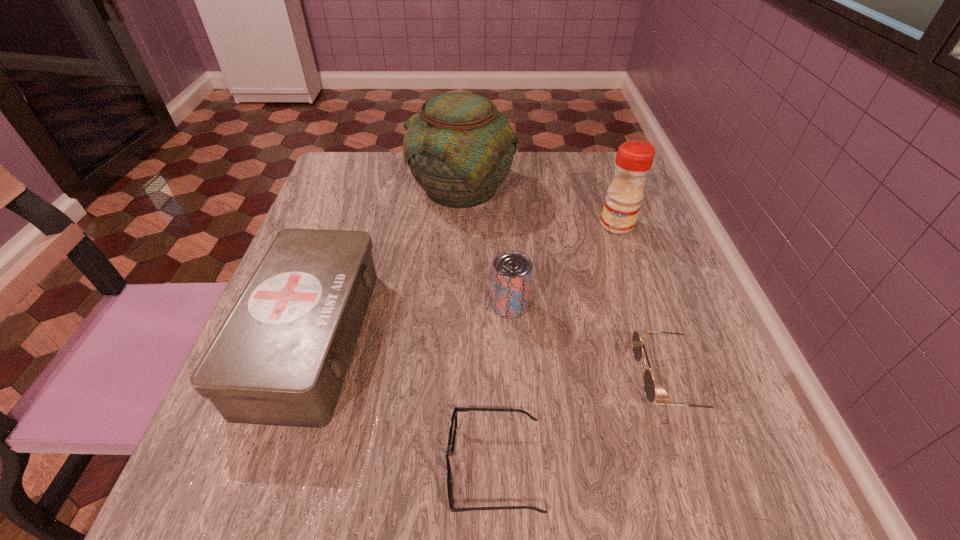
Where is `vacant space located 0.090m on the front lenses of the second shortest object`? This screenshot has height=540, width=960. vacant space located 0.090m on the front lenses of the second shortest object is located at coordinates (580, 380).

The height and width of the screenshot is (540, 960). Find the location of `free region located 0.280m on the front lenses of the second shortest object`. free region located 0.280m on the front lenses of the second shortest object is located at coordinates (463, 380).

The image size is (960, 540). Identify the location of vacant space situated 0.200m on the front lenses of the second shortest object. click(513, 380).

Identify the location of vacant space located 0.290m on the front-facing side of the spectacles. (240, 468).

This screenshot has width=960, height=540. What are the coordinates of `free location located 0.270m on the front-facing side of the spectacles` in the screenshot? It's located at (254, 468).

At what (x,y) coordinates should I click in order to perform the action: click on free space located on the front-facing side of the spectacles. Please return your answer as a coordinate pair (x, y). The image size is (960, 540). Looking at the image, I should click on (332, 468).

You are a GUI agent. You are given a task and a screenshot of the screen. Output one action in this format:
    pyautogui.click(x=<x>, y=<y>)
    Task: Click on the object situated at the far edge
    The image size is (960, 540).
    Given the screenshot: What is the action you would take?
    pyautogui.click(x=459, y=147)

Where is `object located at the near edge`? object located at the near edge is located at coordinates (454, 420).

Where is `object that is at the left edge`? The width and height of the screenshot is (960, 540). object that is at the left edge is located at coordinates (281, 356).

The width and height of the screenshot is (960, 540). Identify the location of condiment that is at the right edge. (634, 159).